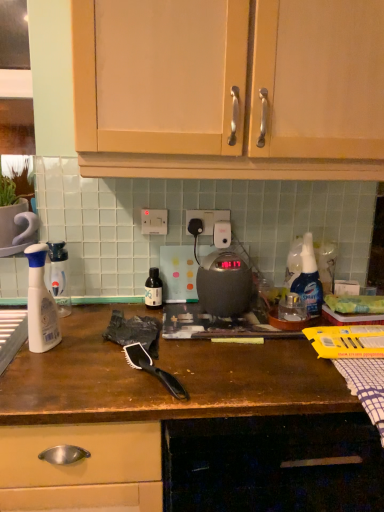
Where is `vacant region to the left of translucent plastic spray bottle at left`? vacant region to the left of translucent plastic spray bottle at left is located at coordinates (10, 342).